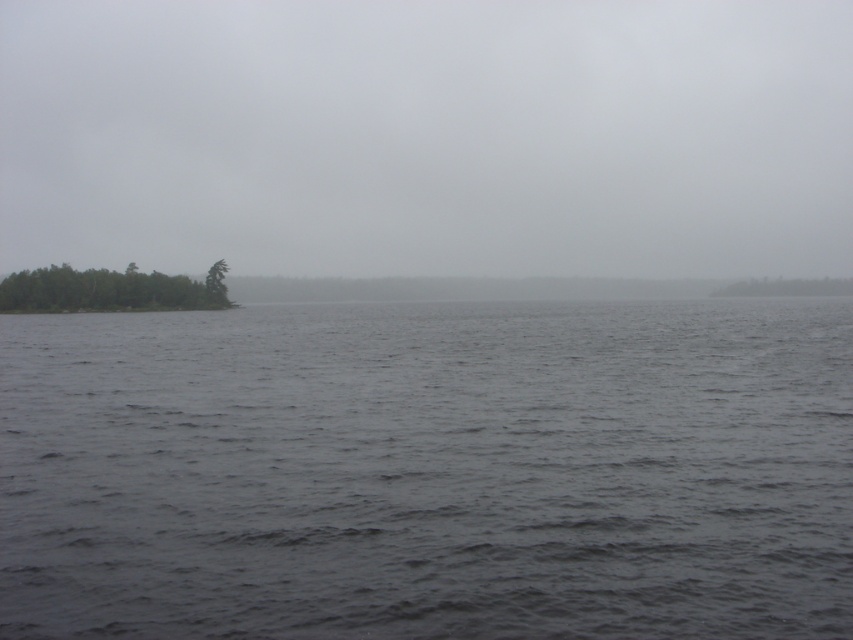
You are a drone operator trying to navigate between two points in the image. The first point is at coordinates point [164,307] and the second point is at point [849,284]. Which point is closer to the observer?

Point [164,307] is in front of point [849,284], so it is closer to the observer.

In the scene shown: You are an artist trying to paint the scene. You have to decide which area to focus on first based on their sizes. Which object should you paint first, the gray cloudy sky at upper center or the green matte tree at center?

The gray cloudy sky at upper center should be painted first because its width is larger than the green matte tree at center, making it a more prominent feature in the scene.

You are standing on the island with green leafy trees at left and looking towards the dark gray water at center. Which object appears taller from your perspective?

The green leafy trees at left appear taller than the dark gray water at center from your perspective because the dark gray water at center is not as tall as green leafy trees at left.